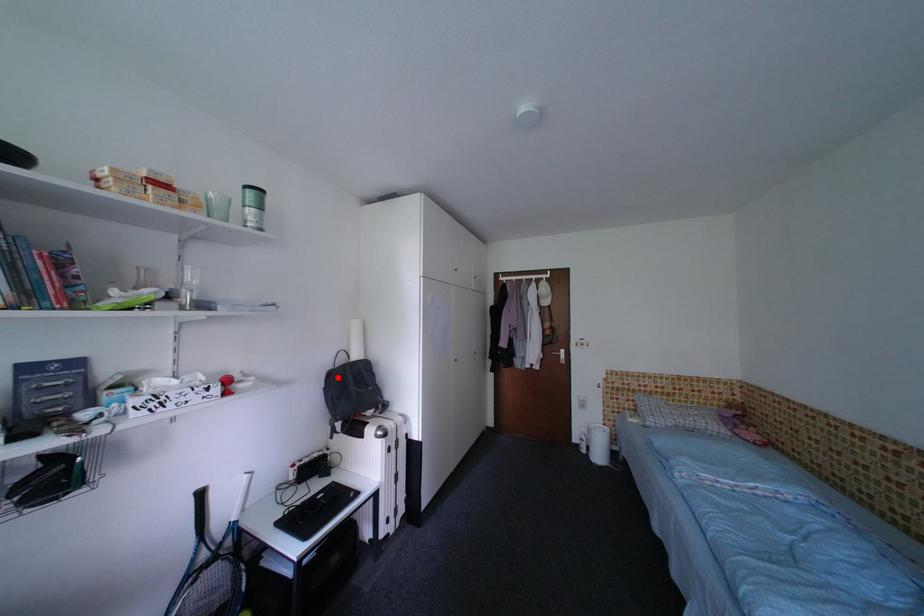
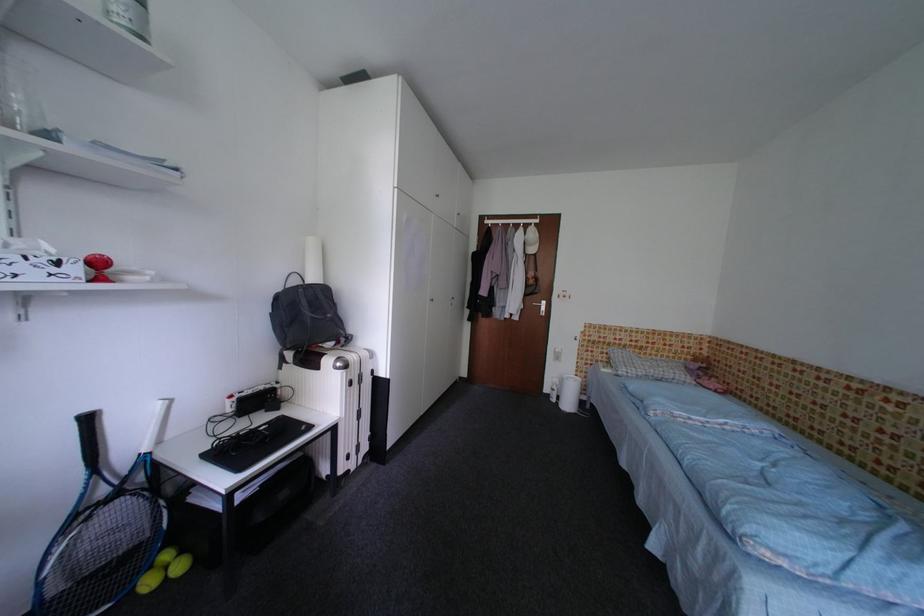
In the second image, find the point that corresponds to the highlighted location in the first image.

(286, 301)